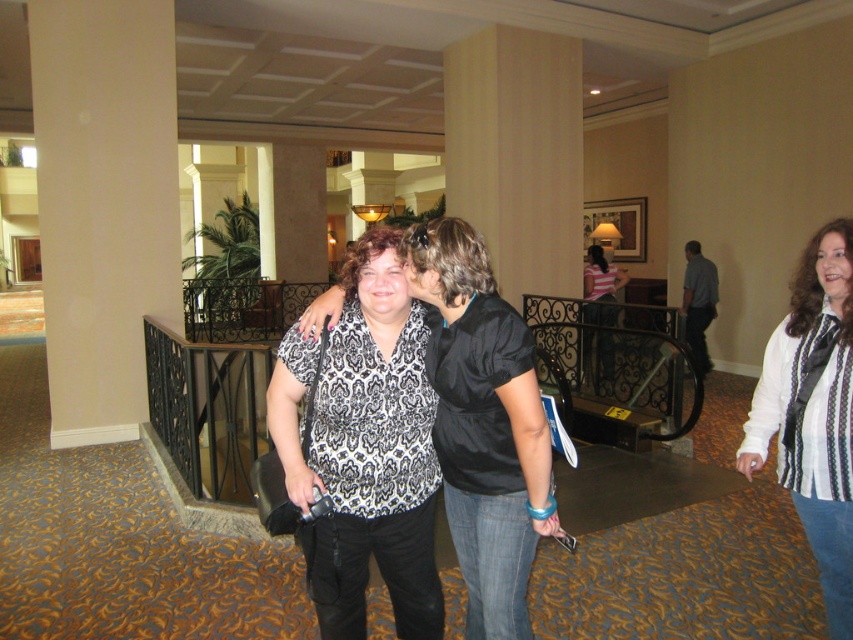
From the picture: You are standing at the point marked as point [367,570] in the hotel lobby. You want to take a photo of the camera held by the woman in the black and white blouse. Can you reach the camera from your current position without moving? Please explain your reasoning.

The distance between point [367,570] and the camera is 7.05 feet. Since you are at point [367,570] and the camera is 7.05 feet away, you cannot reach it without moving closer.

You are a photographer trying to capture a candid shot of the black printed blouse at center. The camera you have is 3.5 feet away from you. Can you reach the camera to take the photo without moving from your current position?

The distance between the black printed blouse at center and the camera is 6.13 feet. Since the camera is only 3.5 feet away from you, you can easily reach it to take the photo without needing to move.